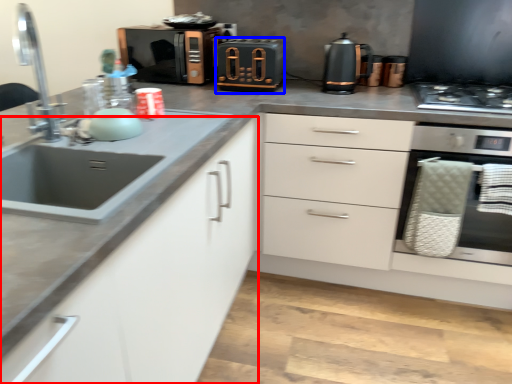
Question: Which object appears farthest to the camera in this image, cabinetry (highlighted by a red box) or appliance (highlighted by a blue box)?

Choices:
 (A) cabinetry
 (B) appliance

Answer: (B)